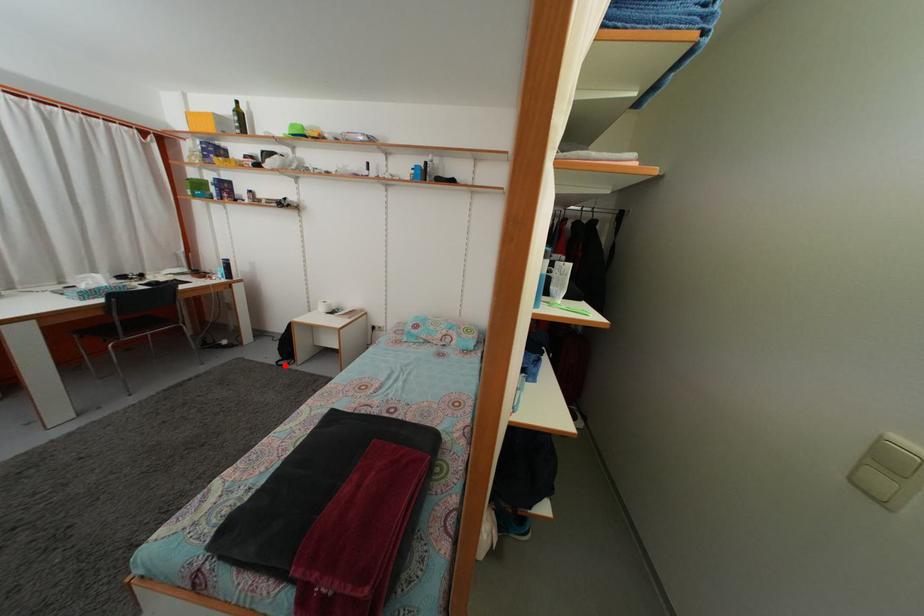
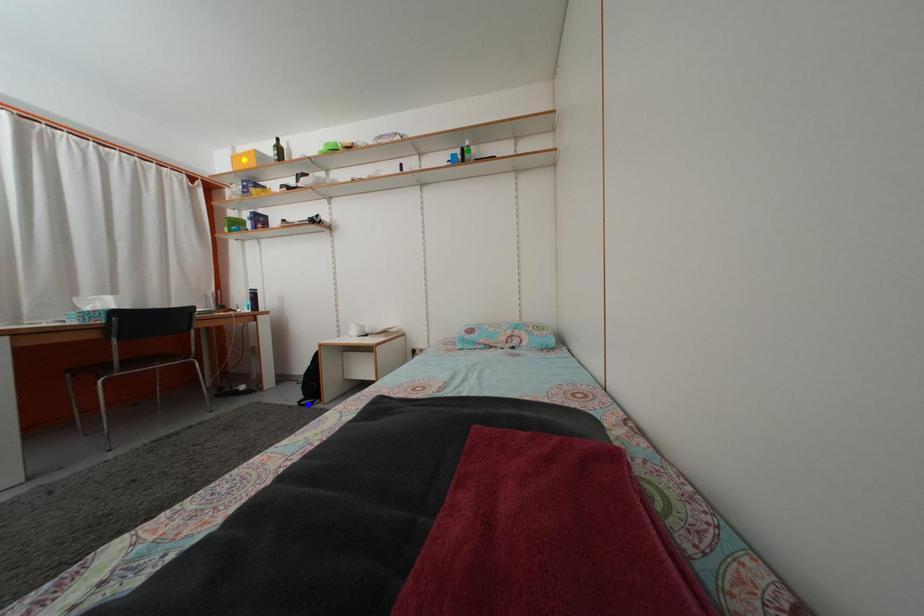
Question: I am providing you with two images of the same scene from different viewpoints. A red point is marked on the first image. You are given multiple points on the second image. Can you choose the point in image 2 that corresponds to the point in image 1?

Choices:
 (A) yellow point
 (B) green point
 (C) blue point

Answer: (C)